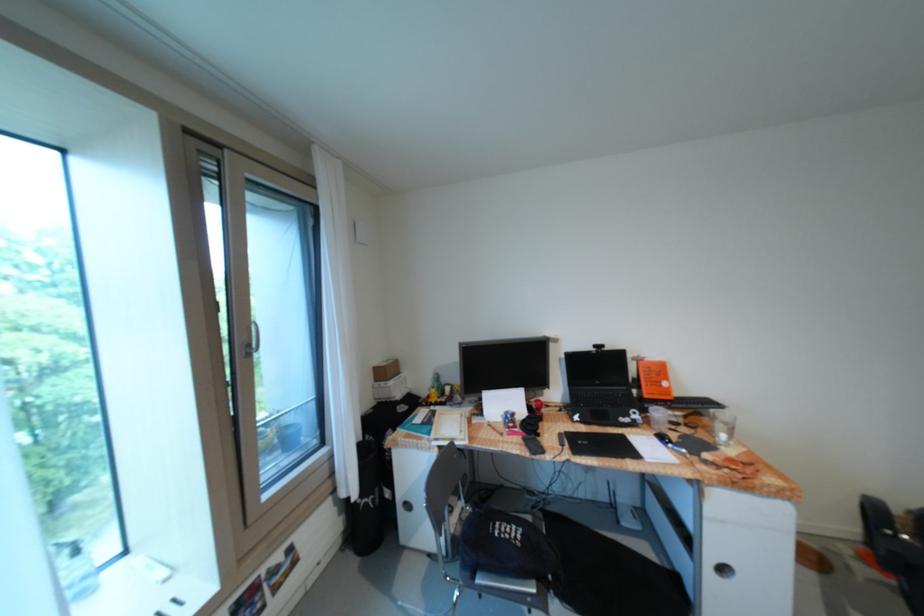
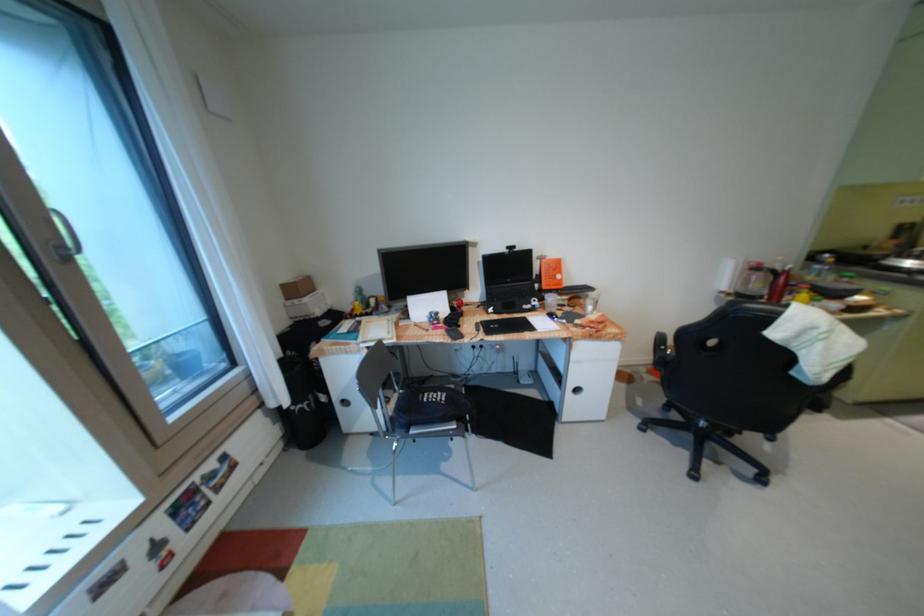
In the second image, find the point that corresponds to the point at 520,419 in the first image.

(444, 318)